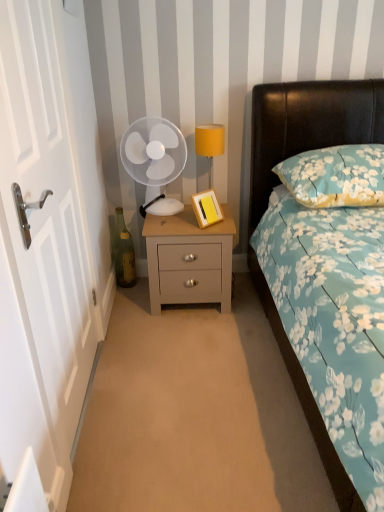
Identify the location of free location in front of matte gray nightstand at center. point(190,337).